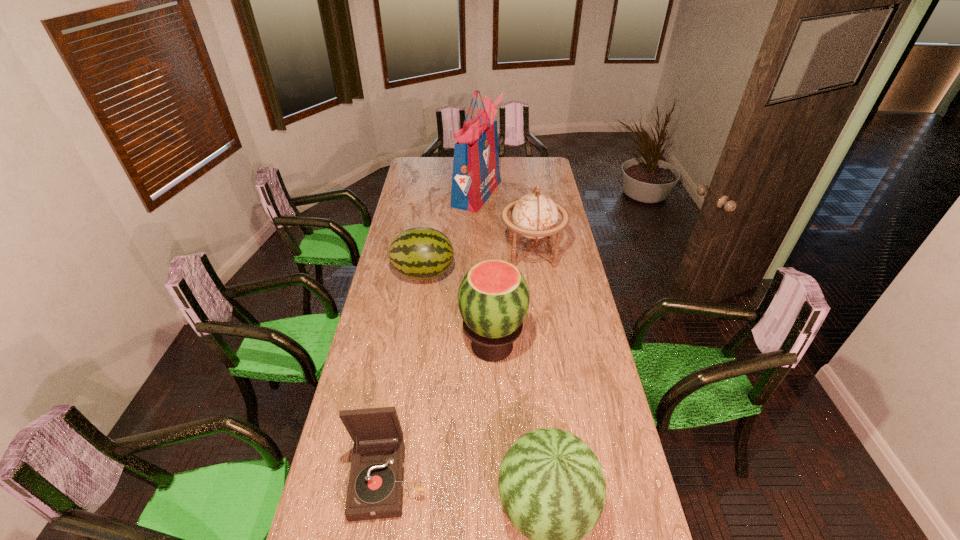
Where is `grocery bag`? The width and height of the screenshot is (960, 540). grocery bag is located at coordinates (476, 174).

The width and height of the screenshot is (960, 540). In order to click on the farthest object in this screenshot , I will do `click(476, 174)`.

I want to click on globe, so click(x=535, y=215).

Locate an element on the screen. the fourth farthest object is located at coordinates 493,298.

This screenshot has height=540, width=960. I want to click on phonograph record, so click(375, 490).

The height and width of the screenshot is (540, 960). What are the coordinates of `the farthest watermelon` in the screenshot? It's located at (421, 253).

Image resolution: width=960 pixels, height=540 pixels. In order to click on the shortest watermelon in this screenshot , I will do `click(421, 253)`.

You are a GUI agent. You are given a task and a screenshot of the screen. Output one action in this format:
    pyautogui.click(x=<x>, y=<y>)
    Task: Click on the free space located 0.220m on the front-facing side of the tallest object
    
    Given the screenshot: What is the action you would take?
    pyautogui.click(x=540, y=193)

Where is `vacant space situated 0.280m at the front of the globe showing Africa`? The width and height of the screenshot is (960, 540). vacant space situated 0.280m at the front of the globe showing Africa is located at coordinates (443, 253).

You are a GUI agent. You are given a task and a screenshot of the screen. Output one action in this format:
    pyautogui.click(x=<x>, y=<y>)
    Task: Click on the free space located 0.290m at the front of the globe showing Africa
    
    Given the screenshot: What is the action you would take?
    pyautogui.click(x=441, y=253)